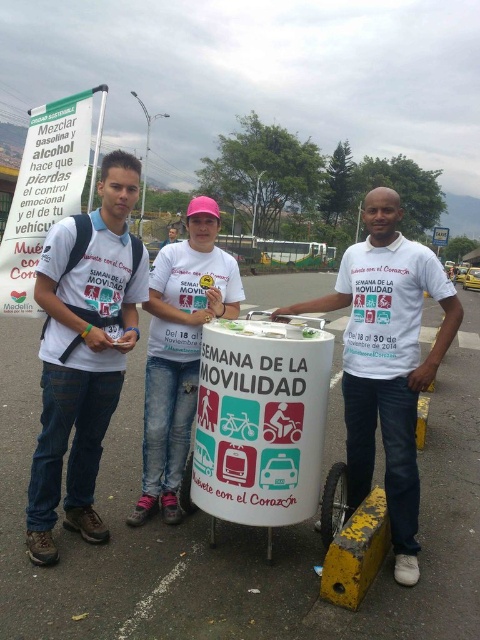
Does matte white t-shirt at center have a lesser height compared to white matte t-shirt at center?

In fact, matte white t-shirt at center may be taller than white matte t-shirt at center.

Which is more to the right, matte white t-shirt at center or white matte t-shirt at center?

white matte t-shirt at center

You are a GUI agent. You are given a task and a screenshot of the screen. Output one action in this format:
    pyautogui.click(x=<x>, y=<y>)
    Task: Click on the matte white t-shirt at center
    This screenshot has width=480, height=640.
    Given the screenshot: What is the action you would take?
    pyautogui.click(x=84, y=352)